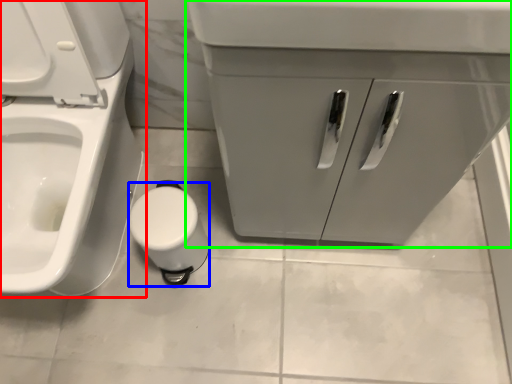
Question: Considering the real-world distances, which object is closest to toilet (highlighted by a red box)? toilet paper (highlighted by a blue box) or bathroom cabinet (highlighted by a green box).

Choices:
 (A) toilet paper
 (B) bathroom cabinet

Answer: (A)